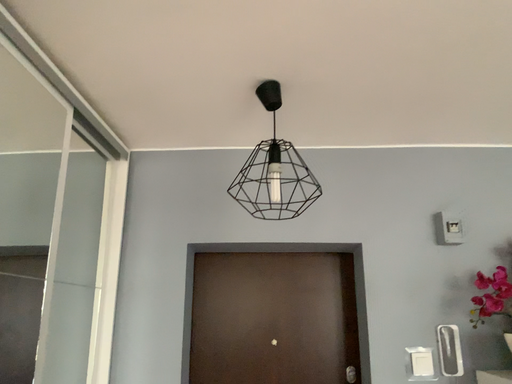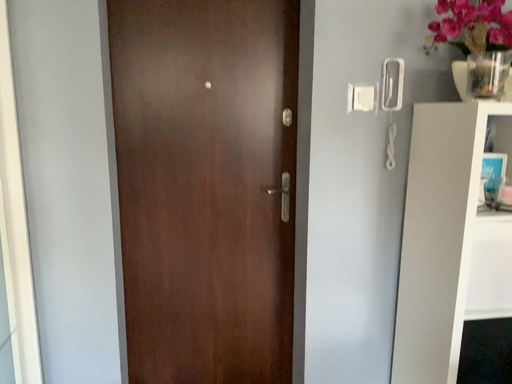
Question: Which way did the camera rotate in the video?

Choices:
 (A) rotated downward
 (B) rotated upward

Answer: (A)